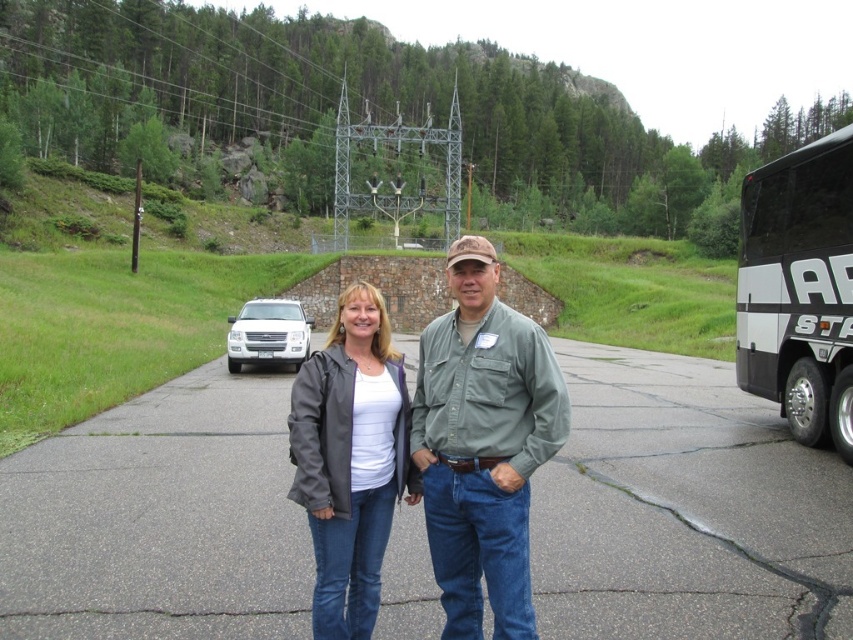
Question: Is green cotton shirt at center smaller than black/white bus at right?

Choices:
 (A) yes
 (B) no

Answer: (A)

Question: Among these objects, which one is nearest to the camera?

Choices:
 (A) matte gray jacket at center
 (B) green cotton shirt at center
 (C) white matte suv at center

Answer: (B)

Question: Which object is closer to the camera taking this photo?

Choices:
 (A) black/white bus at right
 (B) white matte suv at center
 (C) green cotton shirt at center
 (D) matte gray jacket at center

Answer: (C)

Question: Which of the following is the farthest from the observer?

Choices:
 (A) black/white bus at right
 (B) white matte suv at center
 (C) matte gray jacket at center

Answer: (B)

Question: Can you confirm if green cotton shirt at center is positioned above black/white bus at right?

Choices:
 (A) no
 (B) yes

Answer: (A)

Question: Can you confirm if green cotton shirt at center is positioned below white matte suv at center?

Choices:
 (A) no
 (B) yes

Answer: (B)